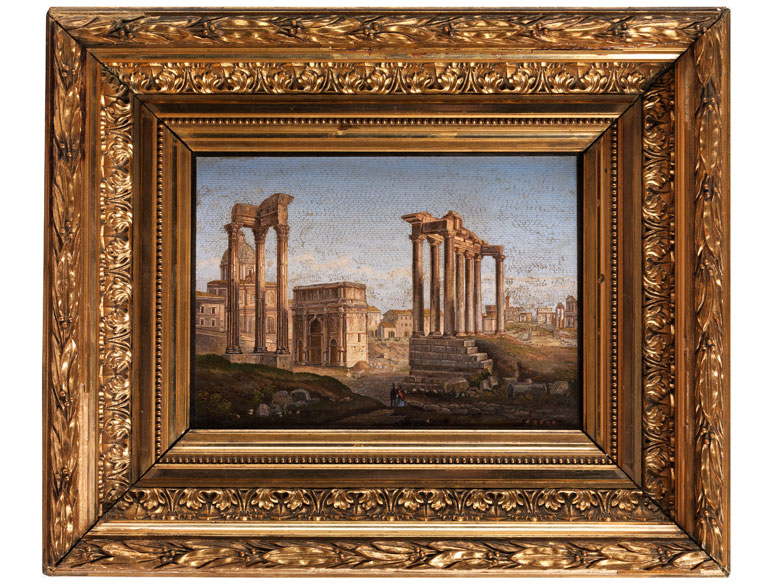
Image resolution: width=780 pixels, height=585 pixels. Find the location of `the top right of painting`. the top right of painting is located at coordinates (572, 161).